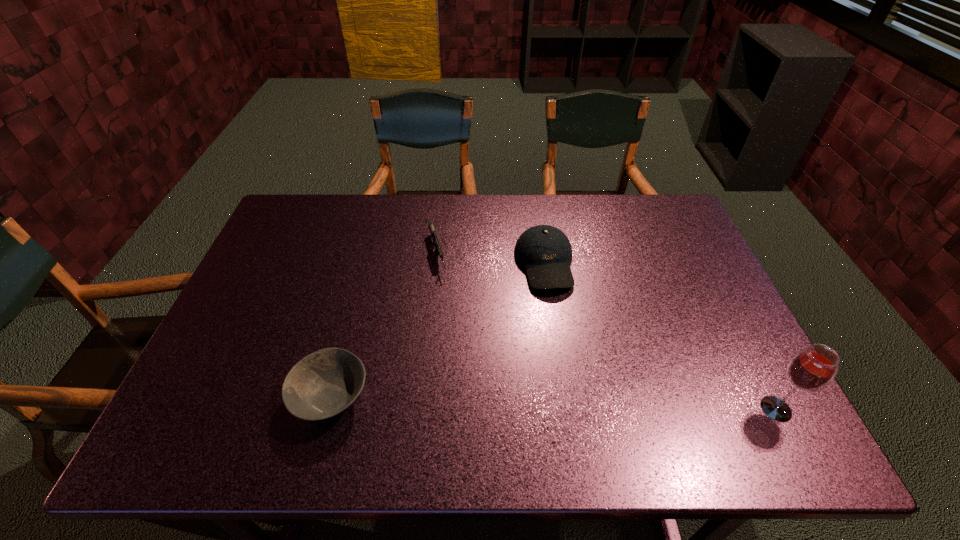
You are a GUI agent. You are given a task and a screenshot of the screen. Output one action in this format:
    pyautogui.click(x=<x>, y=<y>)
    Task: Click on the free space located on the front-facing side of the third shortest object
    The height and width of the screenshot is (540, 960).
    Given the screenshot: What is the action you would take?
    pyautogui.click(x=558, y=319)

Locate an element on the screen. The image size is (960, 540). free point located aimed along the barrel of the gun is located at coordinates (464, 358).

Locate an element on the screen. The width and height of the screenshot is (960, 540). free region located aimed along the barrel of the gun is located at coordinates pyautogui.click(x=448, y=310).

I want to click on free space located 0.070m aimed along the barrel of the gun, so click(444, 295).

Identify the location of baseball cap that is at the far edge. (545, 252).

Where is `gun positioned at the far edge`? gun positioned at the far edge is located at coordinates (438, 248).

At what (x,y) coordinates should I click in order to perform the action: click on bowl located in the near edge section of the desktop. Please return your answer as a coordinate pair (x, y). This screenshot has width=960, height=540. Looking at the image, I should click on (325, 383).

This screenshot has height=540, width=960. Identify the location of wineglass located in the near edge section of the desktop. (812, 369).

Locate an element on the screen. Image resolution: width=960 pixels, height=540 pixels. object that is at the right edge is located at coordinates (812, 369).

At what (x,y) coordinates should I click in order to perform the action: click on object situated at the near right corner. Please return your answer as a coordinate pair (x, y). This screenshot has width=960, height=540. Looking at the image, I should click on (812, 369).